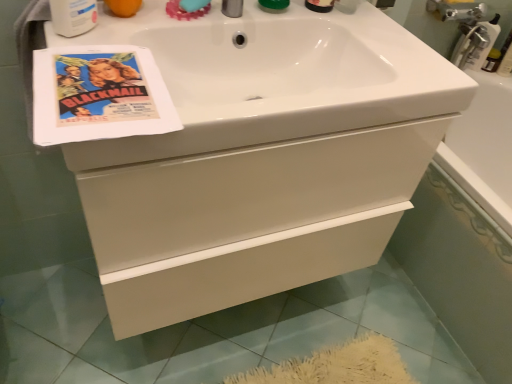
Question: From a real-world perspective, is white glossy cabinet at center physically located above or below vintage paper flyer at upper left?

Choices:
 (A) below
 (B) above

Answer: (A)

Question: In terms of height, does white glossy cabinet at center look taller or shorter compared to vintage paper flyer at upper left?

Choices:
 (A) short
 (B) tall

Answer: (B)

Question: Which object is the closest to the vintage paper flyer at upper left?

Choices:
 (A) teal rubber soap at upper center
 (B) white plastic mouthwash at upper left
 (C) white glossy cabinet at center
 (D) white glossy bathtub at lower right
 (E) white glossy sink at upper center

Answer: (B)

Question: Estimate the real-world distances between objects in this image. Which object is farther from the white glossy sink at upper center?

Choices:
 (A) white glossy bathtub at lower right
 (B) white glossy cabinet at center
 (C) teal rubber soap at upper center
 (D) vintage paper flyer at upper left
 (E) white plastic mouthwash at upper left

Answer: (A)